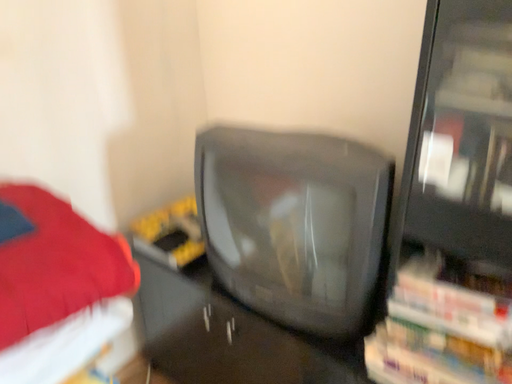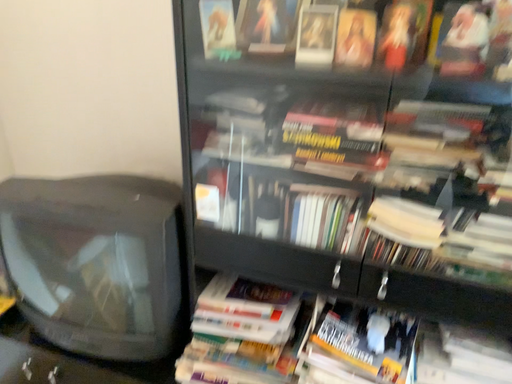
Question: Which way did the camera rotate in the video?

Choices:
 (A) rotated right
 (B) rotated left

Answer: (A)